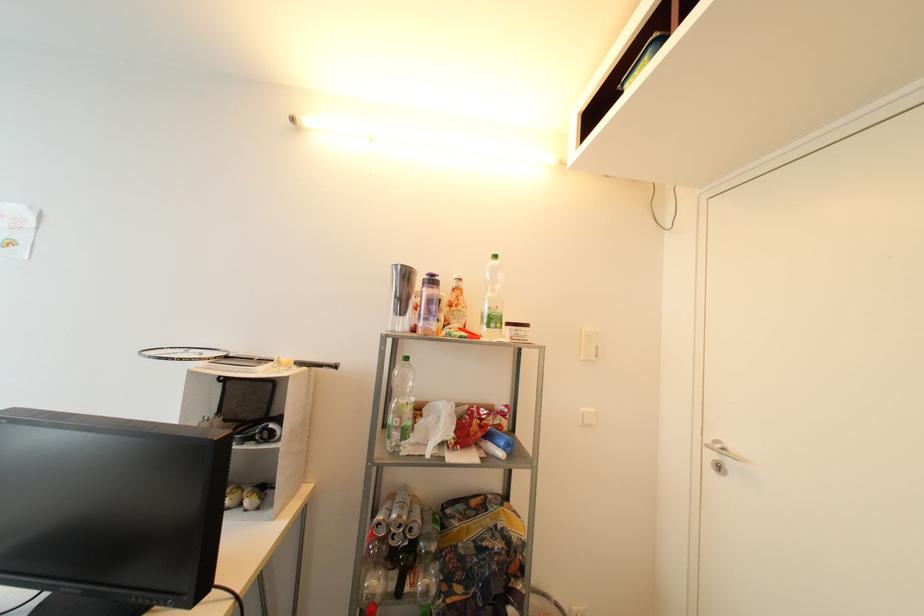
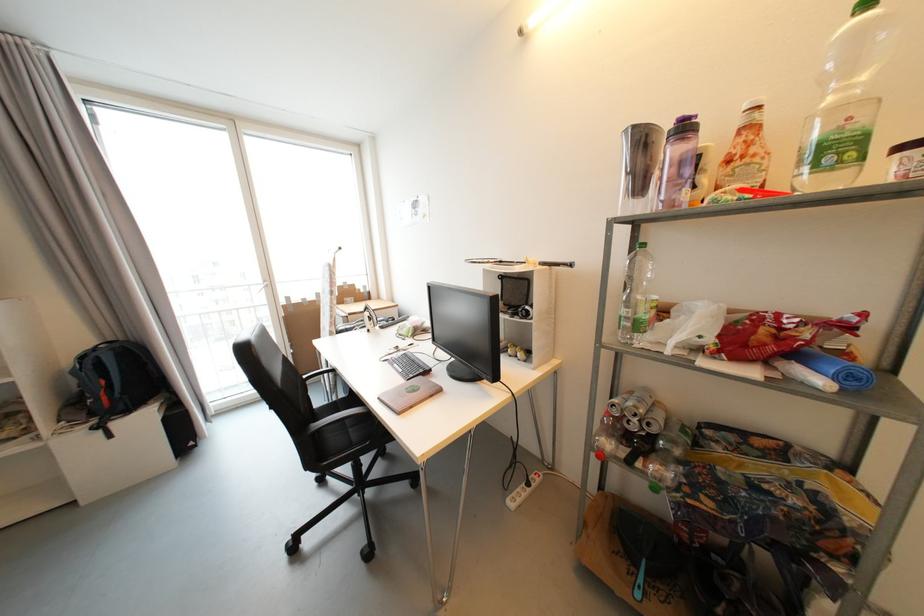
Where in the second image is the point corresponding to point 232,359 from the first image?

(505, 264)